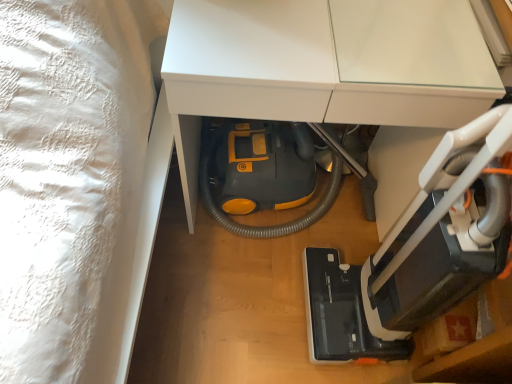
I want to click on vacant space in front of yellow plastic vacuum cleaner at lower center, so click(237, 311).